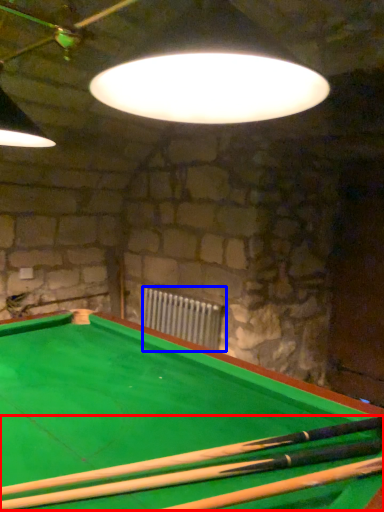
Question: Which point is further to the camera, cue (highlighted by a red box) or radiator (highlighted by a blue box)?

Choices:
 (A) cue
 (B) radiator

Answer: (B)